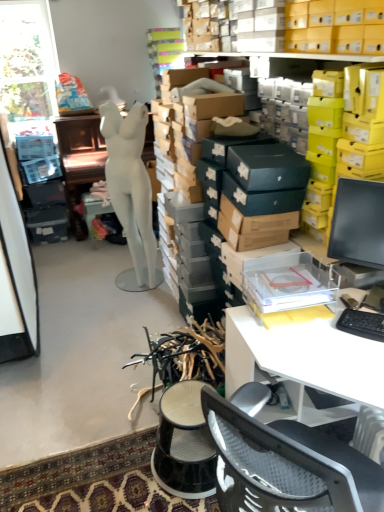
Locate an element on the screen. free location in front of white matte mannequin at center is located at coordinates (122, 312).